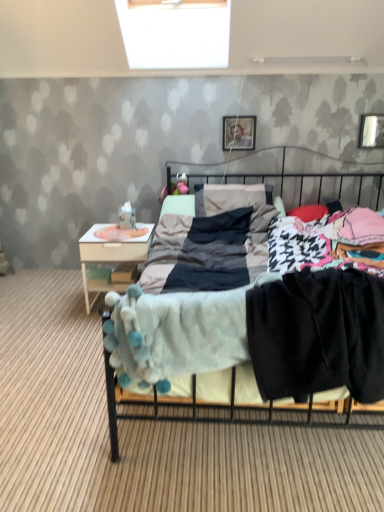
Question: Does soft gray blanket at center have a greater height compared to metallic rectangular frame at upper right, which is counted as the second picture frame, starting from the left?

Choices:
 (A) yes
 (B) no

Answer: (A)

Question: Is soft gray blanket at center to the right of metallic rectangular frame at upper right, which is counted as the second picture frame, starting from the left, from the viewer's perspective?

Choices:
 (A) no
 (B) yes

Answer: (A)

Question: Is soft gray blanket at center bigger than metallic rectangular frame at upper right, which is counted as the second picture frame, starting from the left?

Choices:
 (A) no
 (B) yes

Answer: (B)

Question: From the image's perspective, is soft gray blanket at center located above metallic rectangular frame at upper right, which ranks as the 1th picture frame in right-to-left order?

Choices:
 (A) no
 (B) yes

Answer: (A)

Question: Considering the relative sizes of soft gray blanket at center and metallic rectangular frame at upper right, which is counted as the second picture frame, starting from the left, in the image provided, is soft gray blanket at center shorter than metallic rectangular frame at upper right, which is counted as the second picture frame, starting from the left,?

Choices:
 (A) no
 (B) yes

Answer: (A)

Question: Is soft gray blanket at center in front of metallic rectangular frame at upper right, which ranks as the 1th picture frame in right-to-left order?

Choices:
 (A) yes
 (B) no

Answer: (A)

Question: Is white wood nightstand at left at the left side of black cotton pants at lower right?

Choices:
 (A) no
 (B) yes

Answer: (B)

Question: Is white wood nightstand at left oriented towards black cotton pants at lower right?

Choices:
 (A) no
 (B) yes

Answer: (A)

Question: Is black cotton pants at lower right surrounded by white wood nightstand at left?

Choices:
 (A) no
 (B) yes

Answer: (A)

Question: From a real-world perspective, is white wood nightstand at left on black cotton pants at lower right?

Choices:
 (A) yes
 (B) no

Answer: (B)

Question: Can you see white wood nightstand at left touching black cotton pants at lower right?

Choices:
 (A) yes
 (B) no

Answer: (B)

Question: Considering the relative sizes of white wood nightstand at left and black cotton pants at lower right in the image provided, is white wood nightstand at left thinner than black cotton pants at lower right?

Choices:
 (A) yes
 (B) no

Answer: (A)

Question: Is black cotton pants at lower right at the right side of soft gray blanket at center?

Choices:
 (A) yes
 (B) no

Answer: (B)